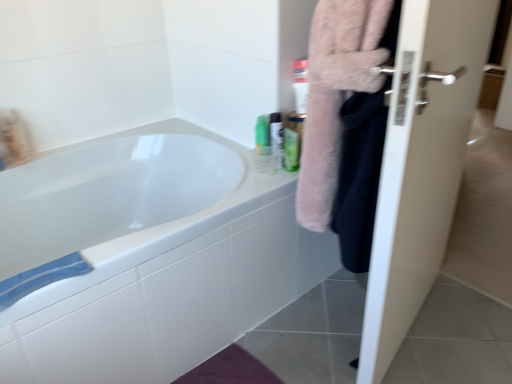
This screenshot has width=512, height=384. Describe the element at coordinates (335, 95) in the screenshot. I see `fluffy pink towel at right, the 1th bath towel from the right` at that location.

What do you see at coordinates (14, 138) in the screenshot?
I see `translucent plastic mouthwash at upper left, arranged as the first mouthwash when viewed from the left` at bounding box center [14, 138].

The image size is (512, 384). What do you see at coordinates (276, 138) in the screenshot? I see `white glossy mouthwash at upper right, acting as the 2th mouthwash starting from the right` at bounding box center [276, 138].

This screenshot has width=512, height=384. I want to click on white glossy mouthwash at upper right, which appears as the 3th mouthwash when viewed from the left, so click(x=276, y=138).

The width and height of the screenshot is (512, 384). I want to click on white glossy bathtub at upper left, so click(x=168, y=285).

I want to click on fluffy pink towel at right, which is counted as the 2th bath towel, starting from the bottom, so click(x=335, y=95).

Which is behind, blue cotton towel at lower left, placed as the 2th bath towel when sorted from right to left, or white glossy bathtub at upper left?

blue cotton towel at lower left, placed as the 2th bath towel when sorted from right to left, is more distant.

From the image's perspective, who appears lower, blue cotton towel at lower left, placed as the 2th bath towel when sorted from right to left, or white glossy bathtub at upper left?

blue cotton towel at lower left, placed as the 2th bath towel when sorted from right to left, appears lower in the image.

Is blue cotton towel at lower left, the 1th bath towel viewed from the left, not near white glossy bathtub at upper left?

No, blue cotton towel at lower left, the 1th bath towel viewed from the left, is not far away from white glossy bathtub at upper left.

Looking at this image, considering the positions of objects blue cotton towel at lower left, which is the 1th bath towel in bottom-to-top order, and white glossy bathtub at upper left in the image provided, who is more to the right, blue cotton towel at lower left, which is the 1th bath towel in bottom-to-top order, or white glossy bathtub at upper left?

white glossy bathtub at upper left is more to the right.

Locate an element on the screen. The image size is (512, 384). bath towel that is the 2nd object to the left of the white glossy door at right, starting at the anchor is located at coordinates (41, 277).

Is blue cotton towel at lower left, marked as the second bath towel in a top-to-bottom arrangement, at the back of white glossy door at right?

No, white glossy door at right is not facing away from blue cotton towel at lower left, marked as the second bath towel in a top-to-bottom arrangement.

Which is more to the left, white glossy door at right or blue cotton towel at lower left, the 1th bath towel viewed from the left?

Positioned to the left is blue cotton towel at lower left, the 1th bath towel viewed from the left.

Considering the sizes of objects white glossy door at right and blue cotton towel at lower left, the 1th bath towel viewed from the left, in the image provided, who is bigger, white glossy door at right or blue cotton towel at lower left, the 1th bath towel viewed from the left,?

With larger size is white glossy door at right.

Is green plastic bottle at upper right, placed as the third mouthwash when sorted from right to left, in front of fluffy pink towel at right, which is counted as the first bath towel, starting from the top?

No.

Considering the relative sizes of green plastic bottle at upper right, placed as the third mouthwash when sorted from right to left, and fluffy pink towel at right, which is the 2th bath towel from left to right, in the image provided, is green plastic bottle at upper right, placed as the third mouthwash when sorted from right to left, bigger than fluffy pink towel at right, which is the 2th bath towel from left to right,?

Actually, green plastic bottle at upper right, placed as the third mouthwash when sorted from right to left, might be smaller than fluffy pink towel at right, which is the 2th bath towel from left to right.

From the image's perspective, relative to fluffy pink towel at right, which is counted as the 2th bath towel, starting from the bottom, is green plastic bottle at upper right, acting as the 2th mouthwash starting from the left, above or below?

Clearly, from the image's perspective, green plastic bottle at upper right, acting as the 2th mouthwash starting from the left, is above fluffy pink towel at right, which is counted as the 2th bath towel, starting from the bottom.

The image size is (512, 384). In order to click on door that is on the right side of white glossy mouthwash at upper right, which appears as the 3th mouthwash when viewed from the left in this screenshot , I will do `click(421, 164)`.

Is white glossy door at right positioned with its back to white glossy mouthwash at upper right, which appears as the 3th mouthwash when viewed from the left?

Absolutely, white glossy door at right is directed away from white glossy mouthwash at upper right, which appears as the 3th mouthwash when viewed from the left.

In the scene shown: Considering their positions, is white glossy door at right located in front of or behind white glossy mouthwash at upper right, acting as the 2th mouthwash starting from the right?

Clearly, white glossy door at right is in front of white glossy mouthwash at upper right, acting as the 2th mouthwash starting from the right.

Which is more to the right, white glossy door at right or white glossy mouthwash at upper right, acting as the 2th mouthwash starting from the right?

From the viewer's perspective, white glossy door at right appears more on the right side.

Which is behind, point (335, 76) or point (180, 367)?

The point (180, 367) is behind.

Is fluffy pink towel at right, which is counted as the first bath towel, starting from the top, to the left or to the right of white glossy bathtub at upper left in the image?

fluffy pink towel at right, which is counted as the first bath towel, starting from the top, is positioned on white glossy bathtub at upper left's right side.

Can you confirm if fluffy pink towel at right, which is counted as the first bath towel, starting from the top, is shorter than white glossy bathtub at upper left?

In fact, fluffy pink towel at right, which is counted as the first bath towel, starting from the top, may be taller than white glossy bathtub at upper left.

Is fluffy pink towel at right, the 1th bath towel from the right, not near white glossy bathtub at upper left?

No.

Based on the photo, from the image's perspective, is green plastic bottle at upper right, placed as the third mouthwash when sorted from right to left, beneath white glossy door at right?

No.

Can you confirm if green plastic bottle at upper right, placed as the third mouthwash when sorted from right to left, is taller than white glossy door at right?

No.

How different are the orientations of green plastic bottle at upper right, placed as the third mouthwash when sorted from right to left, and white glossy door at right in degrees?

There is a 103-degree angle between the facing directions of green plastic bottle at upper right, placed as the third mouthwash when sorted from right to left, and white glossy door at right.

Which is in front, point (19, 286) or point (295, 162)?

Positioned in front is point (19, 286).

In the scene shown: From a real-world perspective, is blue cotton towel at lower left, marked as the second bath towel in a top-to-bottom arrangement, positioned above or below green matte bottle at upper right, the first mouthwash from the right?

blue cotton towel at lower left, marked as the second bath towel in a top-to-bottom arrangement, is below green matte bottle at upper right, the first mouthwash from the right.

Is blue cotton towel at lower left, marked as the second bath towel in a top-to-bottom arrangement, not close to green matte bottle at upper right, the first mouthwash from the right?

They are positioned close to each other.

This screenshot has width=512, height=384. What are the coordinates of `bathtub that appears in front of the blue cotton towel at lower left, the 1th bath towel viewed from the left` in the screenshot? It's located at (168, 285).

Locate an element on the screen. The width and height of the screenshot is (512, 384). the 2nd bath towel behind the white glossy door at right, starting your count from the anchor is located at coordinates (41, 277).

Considering their positions, is translucent plastic mouthwash at upper left, acting as the fourth mouthwash starting from the right, positioned further to green plastic bottle at upper right, placed as the third mouthwash when sorted from right to left, than blue cotton towel at lower left, the 1th bath towel viewed from the left?

translucent plastic mouthwash at upper left, acting as the fourth mouthwash starting from the right, lies further to green plastic bottle at upper right, placed as the third mouthwash when sorted from right to left, than the other object.

Estimate the real-world distances between objects in this image. Which object is further from blue cotton towel at lower left, which is the 1th bath towel in bottom-to-top order, translucent plastic mouthwash at upper left, arranged as the first mouthwash when viewed from the left, or white glossy door at right?

The object further to blue cotton towel at lower left, which is the 1th bath towel in bottom-to-top order, is white glossy door at right.

From the image, which object appears to be nearer to translucent plastic mouthwash at upper left, arranged as the first mouthwash when viewed from the left, white glossy mouthwash at upper right, which appears as the 3th mouthwash when viewed from the left, or fluffy pink towel at right, which is counted as the first bath towel, starting from the top?

The object closer to translucent plastic mouthwash at upper left, arranged as the first mouthwash when viewed from the left, is white glossy mouthwash at upper right, which appears as the 3th mouthwash when viewed from the left.

From the image, which object appears to be nearer to white glossy bathtub at upper left, fluffy pink towel at right, which is counted as the 2th bath towel, starting from the bottom, or green plastic bottle at upper right, placed as the third mouthwash when sorted from right to left?

green plastic bottle at upper right, placed as the third mouthwash when sorted from right to left.

Based on their spatial positions, is fluffy pink towel at right, which is counted as the 2th bath towel, starting from the bottom, or white glossy door at right further from translucent plastic mouthwash at upper left, arranged as the first mouthwash when viewed from the left?

white glossy door at right lies further to translucent plastic mouthwash at upper left, arranged as the first mouthwash when viewed from the left, than the other object.

Looking at the image, which one is located further to white glossy bathtub at upper left, green plastic bottle at upper right, acting as the 2th mouthwash starting from the left, or green matte bottle at upper right, placed as the fourth mouthwash when sorted from left to right?

green matte bottle at upper right, placed as the fourth mouthwash when sorted from left to right.

Based on their spatial positions, is green plastic bottle at upper right, acting as the 2th mouthwash starting from the left, or white glossy bathtub at upper left closer to blue cotton towel at lower left, placed as the 2th bath towel when sorted from right to left?

Among the two, white glossy bathtub at upper left is located nearer to blue cotton towel at lower left, placed as the 2th bath towel when sorted from right to left.

Looking at this image, based on their spatial positions, is green matte bottle at upper right, placed as the fourth mouthwash when sorted from left to right, or white glossy bathtub at upper left closer to fluffy pink towel at right, which is the 2th bath towel from left to right?

green matte bottle at upper right, placed as the fourth mouthwash when sorted from left to right, is positioned closer to the anchor fluffy pink towel at right, which is the 2th bath towel from left to right.

Where is `bathtub located between blue cotton towel at lower left, marked as the second bath towel in a top-to-bottom arrangement, and white glossy mouthwash at upper right, acting as the 2th mouthwash starting from the right, in the left-right direction`? bathtub located between blue cotton towel at lower left, marked as the second bath towel in a top-to-bottom arrangement, and white glossy mouthwash at upper right, acting as the 2th mouthwash starting from the right, in the left-right direction is located at coordinates (168, 285).

This screenshot has width=512, height=384. I want to click on bathtub between blue cotton towel at lower left, the 1th bath towel viewed from the left, and fluffy pink towel at right, which is counted as the 2th bath towel, starting from the bottom, so click(168, 285).

Where is `bathtub situated between translucent plastic mouthwash at upper left, arranged as the first mouthwash when viewed from the left, and fluffy pink towel at right, which is the 2th bath towel from left to right, from left to right`? The width and height of the screenshot is (512, 384). bathtub situated between translucent plastic mouthwash at upper left, arranged as the first mouthwash when viewed from the left, and fluffy pink towel at right, which is the 2th bath towel from left to right, from left to right is located at coordinates (168, 285).

Where is `mouthwash located between white glossy door at right and green matte bottle at upper right, the first mouthwash from the right, in the depth direction`? The image size is (512, 384). mouthwash located between white glossy door at right and green matte bottle at upper right, the first mouthwash from the right, in the depth direction is located at coordinates (276, 138).